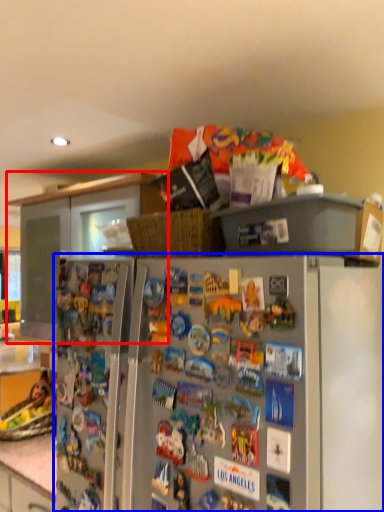
Question: Which object is further to the camera taking this photo, cabinetry (highlighted by a red box) or refrigerator (highlighted by a blue box)?

Choices:
 (A) cabinetry
 (B) refrigerator

Answer: (A)